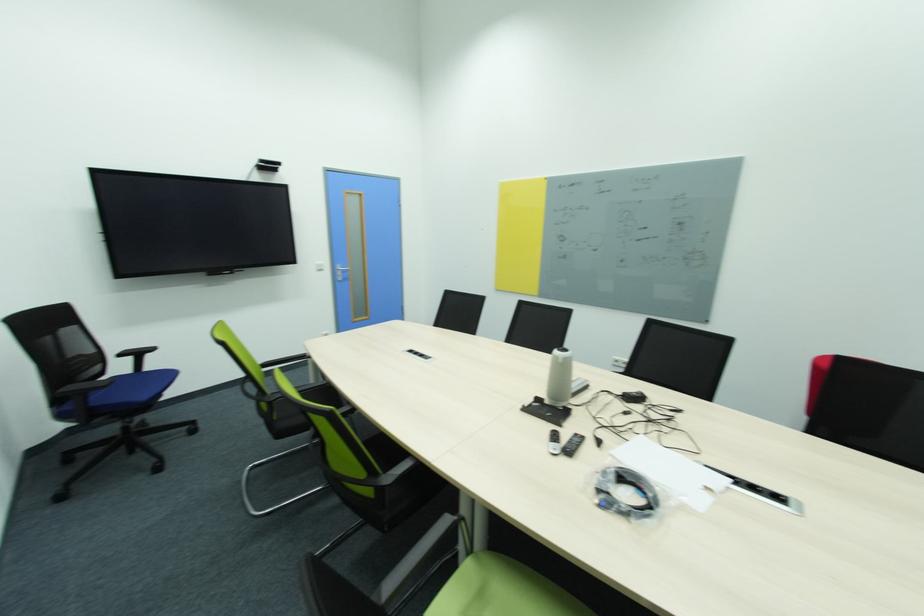
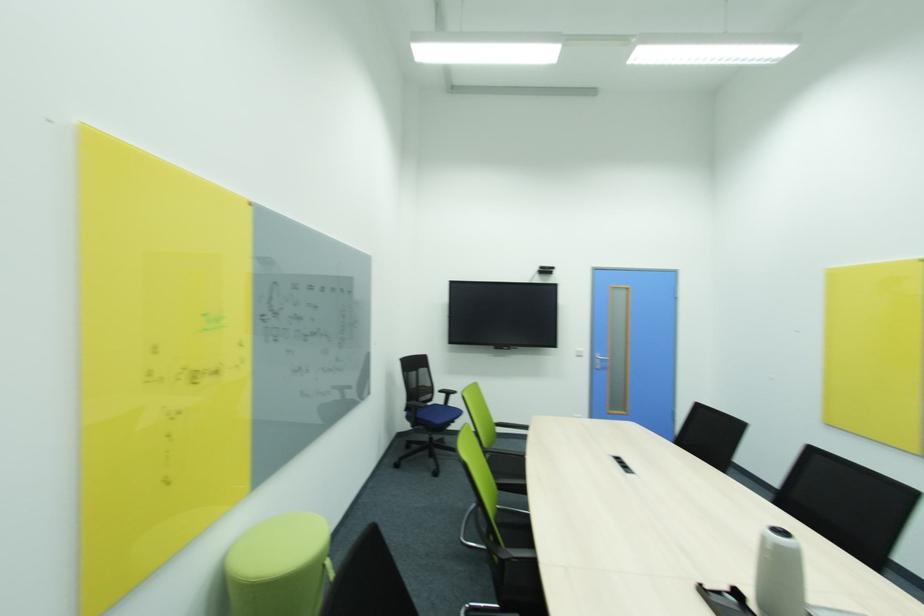
In the second image, find the point that corresponds to point 564,362 in the first image.

(774, 548)